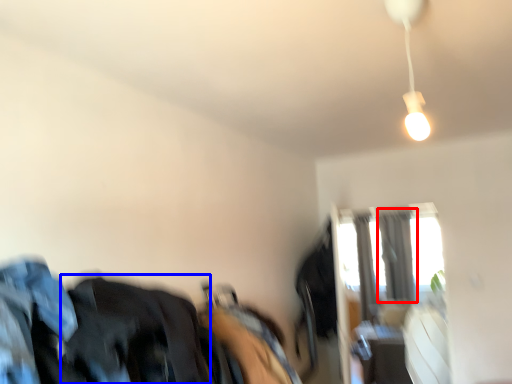
Question: Which object is further to the camera taking this photo, curtain (highlighted by a red box) or clothing (highlighted by a blue box)?

Choices:
 (A) curtain
 (B) clothing

Answer: (A)